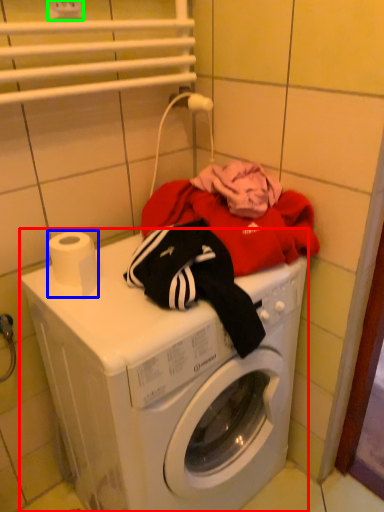
Question: Based on their relative distances, which object is nearer to washing machine (highlighted by a red box)? Choose from toilet paper (highlighted by a blue box) and electric outlet (highlighted by a green box).

Choices:
 (A) toilet paper
 (B) electric outlet

Answer: (A)